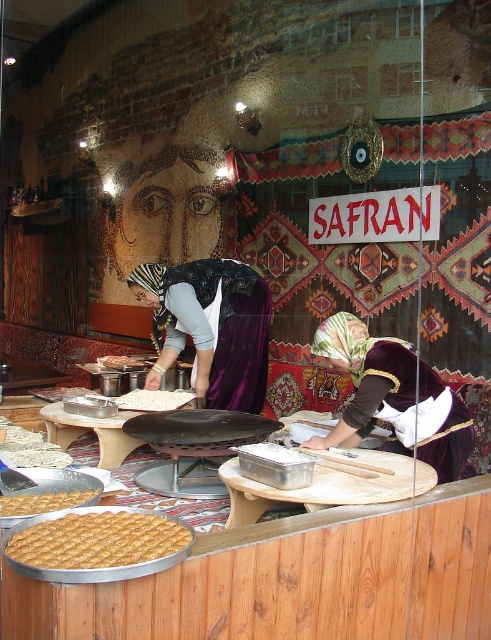
You are a customer at the bakery and want to point out the golden crispy pastry at lower left to the baker. Which direction should you indicate relative to the white matte rice at center?

The golden crispy pastry at lower left is positioned under the white matte rice at center, so you should indicate the direction below the white matte rice at center.

You are a customer at the bakery and want to choose between the golden crispy pastry at lower left and the white matte rice at center. Which one is wider?

The golden crispy pastry at lower left has a lesser width compared to white matte rice at center, so the white matte rice at center is wider.